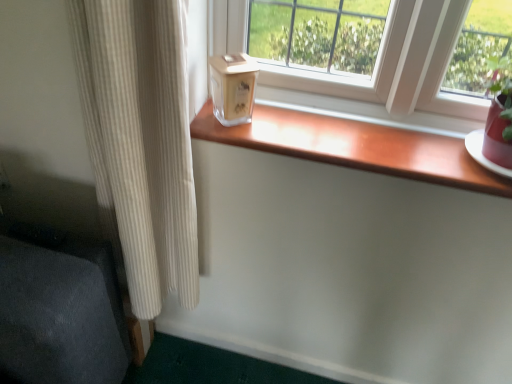
Question: Is wooden at center not within clear glass candle at center?

Choices:
 (A) no
 (B) yes

Answer: (B)

Question: Could you tell me if wooden at center is turned towards clear glass candle at center?

Choices:
 (A) no
 (B) yes

Answer: (A)

Question: Does wooden at center have a greater width compared to clear glass candle at center?

Choices:
 (A) yes
 (B) no

Answer: (A)

Question: Is wooden at center beside clear glass candle at center?

Choices:
 (A) yes
 (B) no

Answer: (B)

Question: Is wooden at center positioned with its back to clear glass candle at center?

Choices:
 (A) no
 (B) yes

Answer: (A)

Question: Considering the positions of wooden at center and beige ribbed curtain at left in the image, is wooden at center bigger or smaller than beige ribbed curtain at left?

Choices:
 (A) big
 (B) small

Answer: (B)

Question: From the image's perspective, is wooden at center located above or below beige ribbed curtain at left?

Choices:
 (A) below
 (B) above

Answer: (B)

Question: In the image, is wooden at center positioned in front of or behind beige ribbed curtain at left?

Choices:
 (A) front
 (B) behind

Answer: (B)

Question: Is wooden at center to the left or to the right of beige ribbed curtain at left in the image?

Choices:
 (A) left
 (B) right

Answer: (B)

Question: Considering their positions, is beige ribbed curtain at left located in front of or behind wooden at center?

Choices:
 (A) front
 (B) behind

Answer: (A)

Question: In the image, is beige ribbed curtain at left on the left side or the right side of wooden at center?

Choices:
 (A) left
 (B) right

Answer: (A)

Question: From a real-world perspective, relative to wooden at center, is beige ribbed curtain at left vertically above or below?

Choices:
 (A) below
 (B) above

Answer: (A)

Question: In terms of size, does beige ribbed curtain at left appear bigger or smaller than wooden at center?

Choices:
 (A) small
 (B) big

Answer: (B)

Question: From a real-world perspective, is beige ribbed curtain at left physically located above or below clear glass candle at center?

Choices:
 (A) above
 (B) below

Answer: (B)

Question: Is beige ribbed curtain at left wider or thinner than clear glass candle at center?

Choices:
 (A) thin
 (B) wide

Answer: (B)